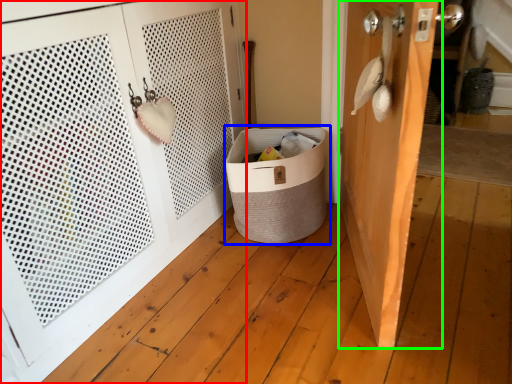
Question: Based on their relative distances, which object is nearer to door (highlighted by a red box)? Choose from laundry basket (highlighted by a blue box) and door (highlighted by a green box).

Choices:
 (A) laundry basket
 (B) door

Answer: (A)